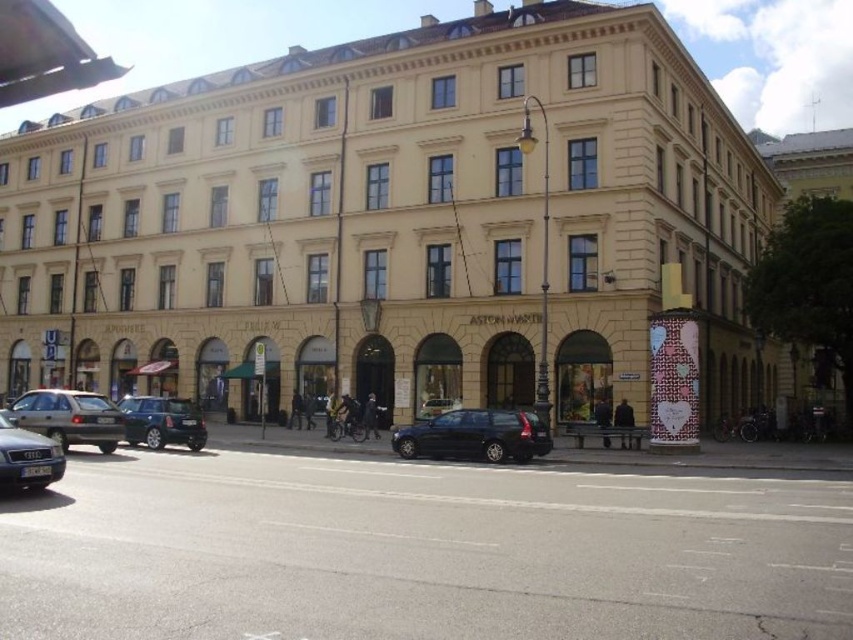
Can you confirm if beige stone building at center is shorter than matte silver car at lower left?

No, beige stone building at center is not shorter than matte silver car at lower left.

Who is more forward, (622, 236) or (61, 426)?

Point (61, 426)

This screenshot has height=640, width=853. I want to click on beige stone building at center, so click(392, 221).

Who is positioned more to the left, beige stone building at center or metallic silver hatchback at center-left?

From the viewer's perspective, metallic silver hatchback at center-left appears more on the left side.

Which is in front, point (111, 300) or point (170, 413)?

Point (170, 413) is in front.

Where is `beige stone building at center`? Image resolution: width=853 pixels, height=640 pixels. beige stone building at center is located at coordinates (392, 221).

Is point (38, 422) less distant than point (155, 410)?

That is True.

Identify the location of matte silver car at lower left. (68, 417).